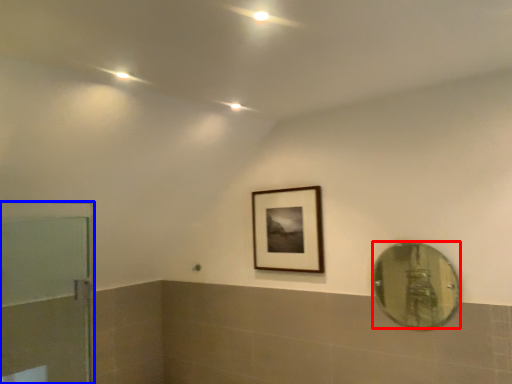
Question: Among these objects, which one is nearest to the camera, mirror (highlighted by a red box) or door (highlighted by a blue box)?

Choices:
 (A) mirror
 (B) door

Answer: (B)